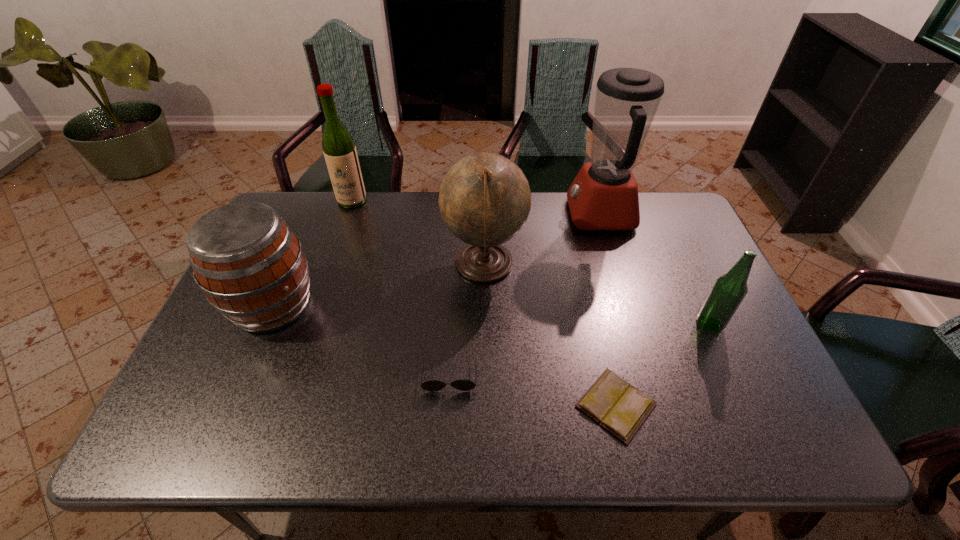
Find the location of a particular element. This screenshot has height=540, width=960. free spot at the far left corner of the desktop is located at coordinates (323, 193).

You are a GUI agent. You are given a task and a screenshot of the screen. Output one action in this format:
    pyautogui.click(x=<x>, y=<y>)
    Task: Click on the vacant space that is in between the blender and the shortest object
    This screenshot has width=960, height=540.
    Given the screenshot: What is the action you would take?
    pyautogui.click(x=608, y=310)

This screenshot has height=540, width=960. Identify the location of vacant area that lies between the globe and the rightmost object. (597, 295).

Where is `vacant area between the rightmost object and the shortest object`? vacant area between the rightmost object and the shortest object is located at coordinates (662, 364).

The height and width of the screenshot is (540, 960). I want to click on empty space between the diary and the liquor, so click(x=484, y=303).

Image resolution: width=960 pixels, height=540 pixels. I want to click on free space between the diary and the beer bottle, so click(x=662, y=364).

At what (x,y) coordinates should I click in order to perform the action: click on free spot between the liquor and the shortest object. Please return your answer as a coordinate pair (x, y). Looking at the image, I should click on (484, 303).

Find the location of `free area in between the cider and the globe`. free area in between the cider and the globe is located at coordinates (378, 285).

Find the location of a particular element. This screenshot has width=960, height=540. empty space between the rightmost object and the globe is located at coordinates (x=597, y=295).

The image size is (960, 540). I want to click on free space between the second shortest object and the blender, so click(x=525, y=294).